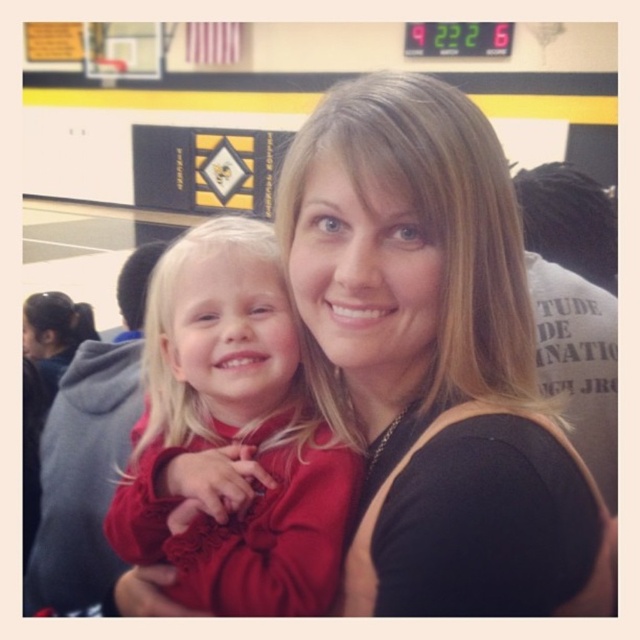
You are standing in the school gymnasium and see two points marked in the image. If you were to walk directly towards the point at coordinates point (444, 144), would you pass by the other point at point (285, 529) first?

Yes, since point (444, 144) is in front of point (285, 529), walking towards the first point would mean passing by the second point first before reaching the destination.

What is the 2D coordinate of the black fabric at center in the image?

The 2D coordinate of the black fabric at center is at point (435, 358).